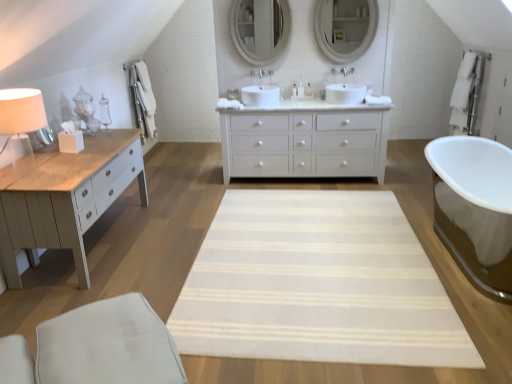
Question: Is beige striped rug at center thinner than white painted wood chest of drawers at center?

Choices:
 (A) no
 (B) yes

Answer: (A)

Question: Can white painted wood chest of drawers at center be found inside beige striped rug at center?

Choices:
 (A) no
 (B) yes

Answer: (A)

Question: Is beige striped rug at center at the right side of white painted wood chest of drawers at center?

Choices:
 (A) no
 (B) yes

Answer: (A)

Question: Does beige striped rug at center appear on the left side of white painted wood chest of drawers at center?

Choices:
 (A) no
 (B) yes

Answer: (B)

Question: Is beige striped rug at center smaller than white painted wood chest of drawers at center?

Choices:
 (A) no
 (B) yes

Answer: (B)

Question: Is beige striped rug at center not inside white painted wood chest of drawers at center?

Choices:
 (A) no
 (B) yes

Answer: (B)

Question: Does white fabric swivel chair at lower left have a greater width compared to beige striped rug at center?

Choices:
 (A) no
 (B) yes

Answer: (A)

Question: Is white fabric swivel chair at lower left oriented away from beige striped rug at center?

Choices:
 (A) no
 (B) yes

Answer: (A)

Question: Is white fabric swivel chair at lower left further to camera compared to beige striped rug at center?

Choices:
 (A) no
 (B) yes

Answer: (A)

Question: Can we say white fabric swivel chair at lower left lies outside beige striped rug at center?

Choices:
 (A) no
 (B) yes

Answer: (B)

Question: Is white fabric swivel chair at lower left bigger than beige striped rug at center?

Choices:
 (A) yes
 (B) no

Answer: (A)

Question: From a real-world perspective, is white fabric swivel chair at lower left located beneath beige striped rug at center?

Choices:
 (A) yes
 (B) no

Answer: (B)

Question: From a real-world perspective, is white ceramic faucet at center, the second faucet when ordered from left to right, on top of white fabric swivel chair at lower left?

Choices:
 (A) yes
 (B) no

Answer: (A)